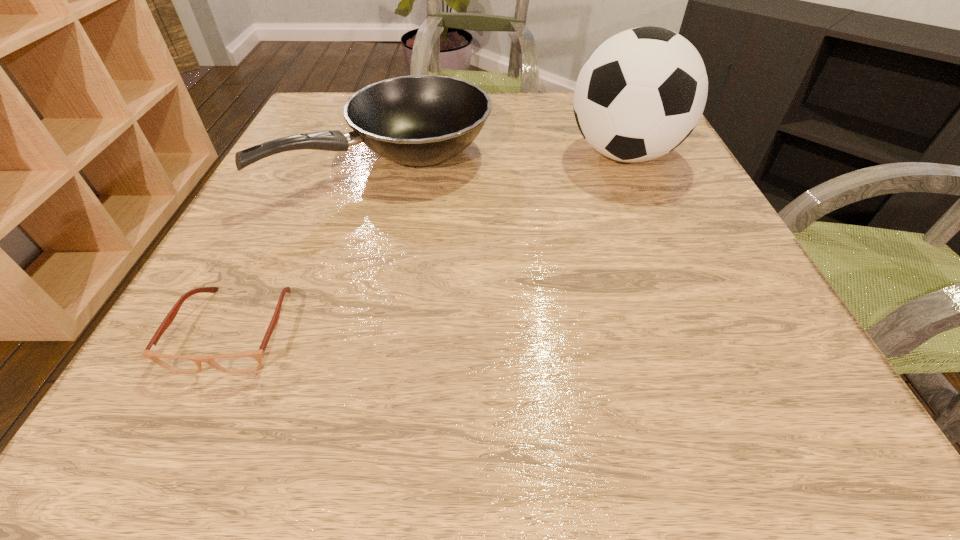
At what (x,y) coordinates should I click in order to perform the action: click on frying pan at the left edge. Please return your answer as a coordinate pair (x, y). The image size is (960, 540). Looking at the image, I should click on (419, 120).

Locate an element on the screen. This screenshot has height=540, width=960. spectacles that is at the left edge is located at coordinates (248, 361).

Locate an element on the screen. The width and height of the screenshot is (960, 540). object located at the right edge is located at coordinates (641, 93).

You are a GUI agent. You are given a task and a screenshot of the screen. Output one action in this format:
    pyautogui.click(x=<x>, y=<y>)
    Task: Click on the object that is at the far left corner
    
    Given the screenshot: What is the action you would take?
    pyautogui.click(x=419, y=120)

Where is `object at the far right corner`? object at the far right corner is located at coordinates (641, 93).

Locate an element on the screen. vacant region at the far edge is located at coordinates (x=546, y=109).

The width and height of the screenshot is (960, 540). I want to click on free space at the near edge of the desktop, so click(x=620, y=401).

Where is `vacant space at the left edge`? Image resolution: width=960 pixels, height=540 pixels. vacant space at the left edge is located at coordinates (306, 269).

Locate an element on the screen. free region at the right edge of the desktop is located at coordinates (671, 246).

Find the location of `free space at the near left corner of the desktop`. free space at the near left corner of the desktop is located at coordinates (173, 446).